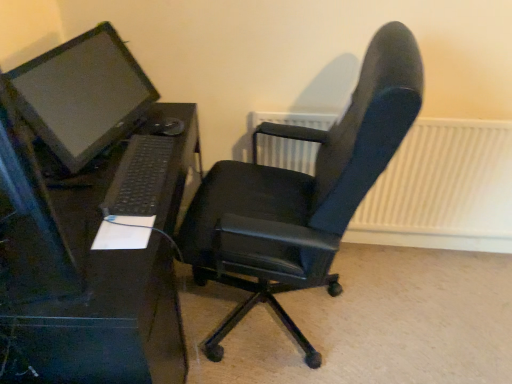
You are a GUI agent. You are given a task and a screenshot of the screen. Output one action in this format:
    pyautogui.click(x=<x>, y=<y>)
    Task: Click on the free location to the left of black plastic keyboard at lower left
    
    Given the screenshot: What is the action you would take?
    pyautogui.click(x=81, y=174)